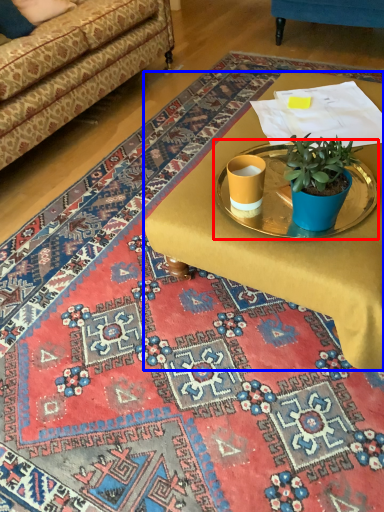
Question: Which of the following is the closest to the observer, round table (highlighted by a red box) or desk (highlighted by a blue box)?

Choices:
 (A) round table
 (B) desk

Answer: (B)